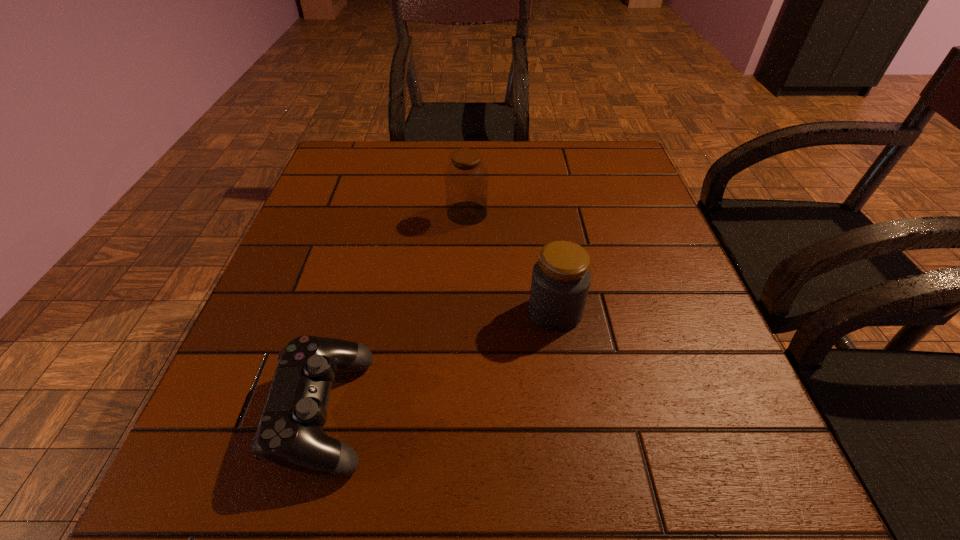
I want to click on the farther jar, so click(x=466, y=179).

Find the location of `the farthest object`. the farthest object is located at coordinates (466, 179).

Where is `the right jar`? the right jar is located at coordinates (561, 278).

The height and width of the screenshot is (540, 960). Identify the location of the rightmost object. (561, 278).

Where is `control`? control is located at coordinates (290, 434).

Identify the location of the leftmost object. (290, 434).

I want to click on free spot located on the right of the farther jar, so click(x=658, y=213).

Where is `free location located 0.180m on the surface of the second nearest object near the warning symbol`? This screenshot has height=540, width=960. free location located 0.180m on the surface of the second nearest object near the warning symbol is located at coordinates (428, 312).

At what (x,y) coordinates should I click in order to perform the action: click on vacant area situated on the surface of the second nearest object near the warning symbol. Please return your answer as a coordinate pair (x, y). The height and width of the screenshot is (540, 960). Looking at the image, I should click on (490, 312).

Locate an element on the screen. The height and width of the screenshot is (540, 960). vacant space located 0.360m on the surface of the second nearest object near the warning symbol is located at coordinates (329, 312).